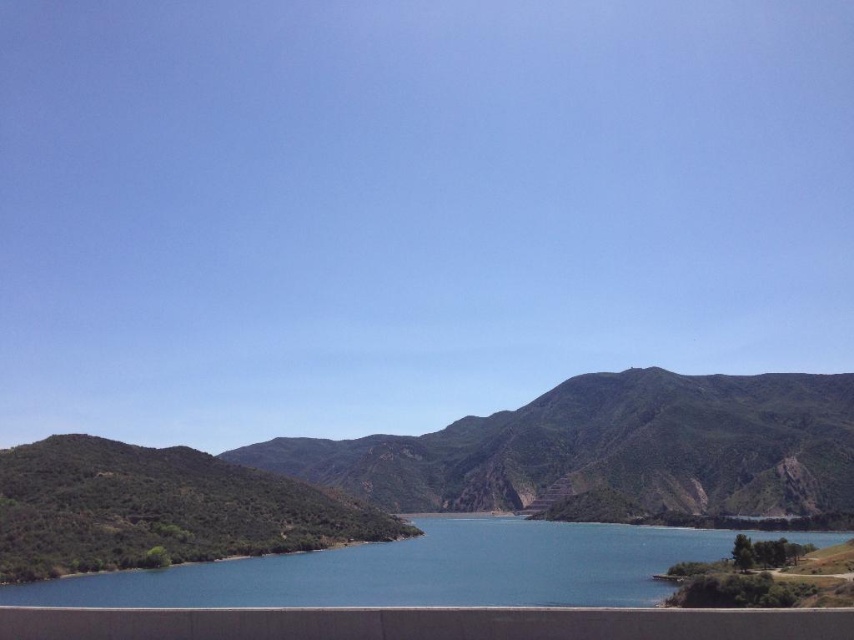
Is green textured hillside at center in front of blue water at center?

No, green textured hillside at center is behind blue water at center.

You are a GUI agent. You are given a task and a screenshot of the screen. Output one action in this format:
    pyautogui.click(x=<x>, y=<y>)
    Task: Click on the green textured hillside at center
    The width and height of the screenshot is (854, 640).
    Given the screenshot: What is the action you would take?
    pyautogui.click(x=437, y=472)